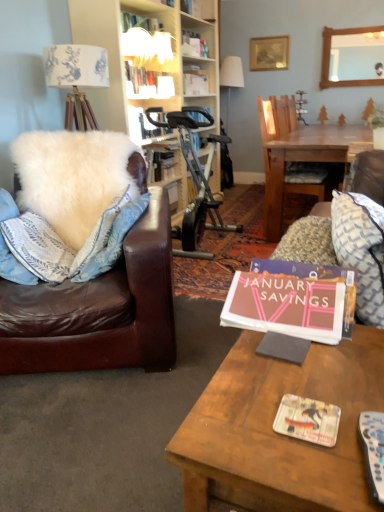
This screenshot has height=512, width=384. What do you see at coordinates (269, 53) in the screenshot?
I see `wooden picture frame at upper center` at bounding box center [269, 53].

Find the location of `patterned fabric pillow at right, which ranks as the 1th pillow in front-to-back order`. patterned fabric pillow at right, which ranks as the 1th pillow in front-to-back order is located at coordinates (361, 250).

The image size is (384, 512). Find the location of `wooden chair at center`. wooden chair at center is located at coordinates (284, 153).

What do you see at coordinates (307, 420) in the screenshot?
I see `matte paper magazine at center` at bounding box center [307, 420].

Where is `matte white book at upper center, which is the 2th book from front to back`? This screenshot has height=512, width=384. matte white book at upper center, which is the 2th book from front to back is located at coordinates tap(148, 82).

From a real-world perspective, between white fabric lampshade at upper center and matte pink book at center, the first book viewed from the right, who is vertically lower?

matte pink book at center, the first book viewed from the right, is physically lower.

Is matte pink book at center, placed as the second book when sorted from back to front, at the back of white fabric lampshade at upper center?

No, white fabric lampshade at upper center is not facing the opposite direction of matte pink book at center, placed as the second book when sorted from back to front.

Can you confirm if white fabric lampshade at upper center is smaller than matte pink book at center, the 2th book in the top-to-bottom sequence?

No, white fabric lampshade at upper center is not smaller than matte pink book at center, the 2th book in the top-to-bottom sequence.

From the image's perspective, which one is positioned lower, white fabric lampshade at upper center or patterned fabric pillow at right, the 2th pillow in the left-to-right sequence?

patterned fabric pillow at right, the 2th pillow in the left-to-right sequence, is shown below in the image.

Does white fabric lampshade at upper center have a larger size compared to patterned fabric pillow at right, which appears as the 2th pillow when viewed from the back?

Yes, white fabric lampshade at upper center is bigger than patterned fabric pillow at right, which appears as the 2th pillow when viewed from the back.

Considering the positions of objects white fabric lampshade at upper center and patterned fabric pillow at right, the first pillow when ordered from right to left, in the image provided, who is more to the left, white fabric lampshade at upper center or patterned fabric pillow at right, the first pillow when ordered from right to left,?

white fabric lampshade at upper center.

Are white fabric lampshade at upper center and patterned fabric pillow at right, which ranks as the 1th pillow in front-to-back order, located far from each other?

Absolutely, white fabric lampshade at upper center is distant from patterned fabric pillow at right, which ranks as the 1th pillow in front-to-back order.

In order to click on book beneath the matte white book at upper center, placed as the 1th book when sorted from left to right (from a real-world perspective) in this screenshot , I will do `click(286, 306)`.

Is matte white book at upper center, arranged as the first book when viewed from the top, at the back of matte pink book at center, placed as the second book when sorted from back to front?

No, matte white book at upper center, arranged as the first book when viewed from the top, is not at the back of matte pink book at center, placed as the second book when sorted from back to front.

Considering the sizes of matte pink book at center, the 2th book in the top-to-bottom sequence, and matte white book at upper center, placed as the 1th book when sorted from left to right, in the image, is matte pink book at center, the 2th book in the top-to-bottom sequence, wider or thinner than matte white book at upper center, placed as the 1th book when sorted from left to right,?

Considering their sizes, matte pink book at center, the 2th book in the top-to-bottom sequence, looks broader than matte white book at upper center, placed as the 1th book when sorted from left to right.

Is matte pink book at center, placed as the second book when sorted from back to front, to the right of matte white book at upper center, the second book when ordered from bottom to top, from the viewer's perspective?

Indeed, matte pink book at center, placed as the second book when sorted from back to front, is positioned on the right side of matte white book at upper center, the second book when ordered from bottom to top.

Considering the sizes of objects white fabric lampshade at upper center and wooden chair at center in the image provided, who is thinner, white fabric lampshade at upper center or wooden chair at center?

With smaller width is white fabric lampshade at upper center.

From a real-world perspective, is white fabric lampshade at upper center on top of wooden chair at center?

Yes.

Is white fabric lampshade at upper center in contact with wooden chair at center?

No, white fabric lampshade at upper center is not in contact with wooden chair at center.

Are matte white book at upper center, the second book when ordered from bottom to top, and white fabric lampshade at upper center located far from each other?

Yes, matte white book at upper center, the second book when ordered from bottom to top, and white fabric lampshade at upper center are quite far apart.

Considering the relative sizes of matte white book at upper center, marked as the first book in a back-to-front arrangement, and white fabric lampshade at upper center in the image provided, is matte white book at upper center, marked as the first book in a back-to-front arrangement, bigger than white fabric lampshade at upper center?

Incorrect, matte white book at upper center, marked as the first book in a back-to-front arrangement, is not larger than white fabric lampshade at upper center.

Is matte white book at upper center, placed as the 1th book when sorted from left to right, not inside white fabric lampshade at upper center?

Yes.

Which is farther from the camera, (164, 73) or (227, 74)?

Positioned behind is point (227, 74).

Who is shorter, white plastic remote control at lower right or matte white book at upper center, which is the 2th book from front to back?

white plastic remote control at lower right.

Considering the relative positions of white plastic remote control at lower right and matte white book at upper center, marked as the second book in a right-to-left arrangement, in the image provided, is white plastic remote control at lower right to the left or to the right of matte white book at upper center, marked as the second book in a right-to-left arrangement,?

In the image, white plastic remote control at lower right appears on the right side of matte white book at upper center, marked as the second book in a right-to-left arrangement.

Is white plastic remote control at lower right facing towards matte white book at upper center, which is the 2th book from front to back?

No, white plastic remote control at lower right is not facing towards matte white book at upper center, which is the 2th book from front to back.

Looking at this image, is the depth of white plastic remote control at lower right greater than that of matte white book at upper center, marked as the second book in a right-to-left arrangement?

No, white plastic remote control at lower right is closer to the viewer.

Is white fluffy pillow at left, the first pillow from the back, facing towards matte paper magazine at center?

Yes, white fluffy pillow at left, the first pillow from the back, is facing matte paper magazine at center.

Is matte paper magazine at center completely or partially inside white fluffy pillow at left, which is the second pillow from front to back?

No, matte paper magazine at center is not a part of white fluffy pillow at left, which is the second pillow from front to back.

Can you confirm if white fluffy pillow at left, which is the second pillow from front to back, is positioned to the left of matte paper magazine at center?

Yes, white fluffy pillow at left, which is the second pillow from front to back, is to the left of matte paper magazine at center.

Is point (85, 226) closer or farther from the camera than point (281, 431)?

Point (85, 226) is positioned farther from the camera compared to point (281, 431).

At what (x,y) coordinates should I click in order to perform the action: click on lamp located above the matte pink book at center, the 1th book from the front (from a real-world perspective). Please return your answer as a coordinate pair (x, y). The image size is (384, 512). Looking at the image, I should click on (231, 76).

This screenshot has width=384, height=512. I want to click on lamp above the patterned fabric pillow at right, which appears as the 2th pillow when viewed from the back (from the image's perspective), so click(231, 76).

Looking at this image, which object lies further to the anchor point wooden picture frame at upper center, matte pink book at center, the 2th book in the top-to-bottom sequence, or wooden chair at center?

Among the two, matte pink book at center, the 2th book in the top-to-bottom sequence, is located further to wooden picture frame at upper center.

Estimate the real-world distances between objects in this image. Which object is further from wooden chair at center, matte white book at upper center, marked as the first book in a back-to-front arrangement, or wooden picture frame at upper center?

wooden picture frame at upper center.

Looking at the image, which one is located further to white plastic remote control at lower right, white fluffy pillow at left, the first pillow from the back, or matte white book at upper center, marked as the second book in a right-to-left arrangement?

matte white book at upper center, marked as the second book in a right-to-left arrangement, lies further to white plastic remote control at lower right than the other object.

Which object lies nearer to the anchor point matte paper magazine at center, white plastic remote control at lower right or white fabric lampshade at upper center?

Among the two, white plastic remote control at lower right is located nearer to matte paper magazine at center.

From the image, which object appears to be farther from matte pink book at center, placed as the second book when sorted from back to front, white fluffy pillow at left, the first pillow from the back, or matte white book at upper center, placed as the 1th book when sorted from left to right?

The object further to matte pink book at center, placed as the second book when sorted from back to front, is matte white book at upper center, placed as the 1th book when sorted from left to right.

From the image, which object appears to be farther from wooden table at center, matte pink book at center, the 1th book from the front, or white fabric lampshade at upper center?

white fabric lampshade at upper center is further to wooden table at center.

When comparing their distances from wooden mirror at upper center, does matte paper magazine at center or white plastic remote control at lower right seem closer?

matte paper magazine at center.

Looking at the image, which one is located closer to white plastic remote control at lower right, white fluffy pillow at left, the first pillow from the back, or wooden mirror at upper center?

The object closer to white plastic remote control at lower right is white fluffy pillow at left, the first pillow from the back.

Find the location of a particular element. This screenshot has height=512, width=384. pillow between patterned fabric pillow at right, which ranks as the 1th pillow in front-to-back order, and wooden chair at center in the front-back direction is located at coordinates (76, 177).

Where is `remote control located between wooden table at center and wooden picture frame at upper center in the depth direction`? The height and width of the screenshot is (512, 384). remote control located between wooden table at center and wooden picture frame at upper center in the depth direction is located at coordinates (373, 450).

Where is `remote control between wooden table at center and matte white book at upper center, placed as the 1th book when sorted from left to right, from front to back`? The image size is (384, 512). remote control between wooden table at center and matte white book at upper center, placed as the 1th book when sorted from left to right, from front to back is located at coordinates (373, 450).

You are a GUI agent. You are given a task and a screenshot of the screen. Output one action in this format:
    pyautogui.click(x=<x>, y=<y>)
    Task: Click on the chair positioned between white plastic remote control at lower right and white fabric lampshade at upper center from near to far
    
    Given the screenshot: What is the action you would take?
    pyautogui.click(x=284, y=153)